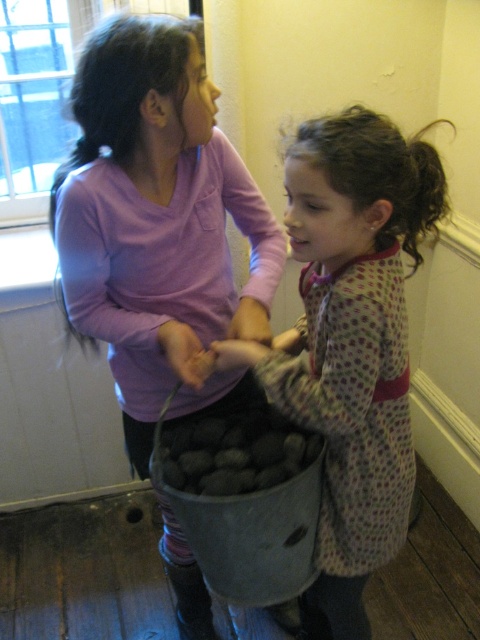
You are standing at the entrance of the room and see the metallic bucket of rocks at center. If you want to move the bucket to the corner near the door, which direction should you move it?

The metallic bucket of rocks at center is located at point (x=351, y=340), so you should move it towards the lower left direction to reach the corner near the door.

You are a robot navigating a room where two points are marked. The first point is at coordinates point (313, 120) and the second is at point (192, 484). According to the image, which point is closer to the entrance of the room?

Point (313, 120) is in front of point (192, 484), so it is closer to the entrance of the room.